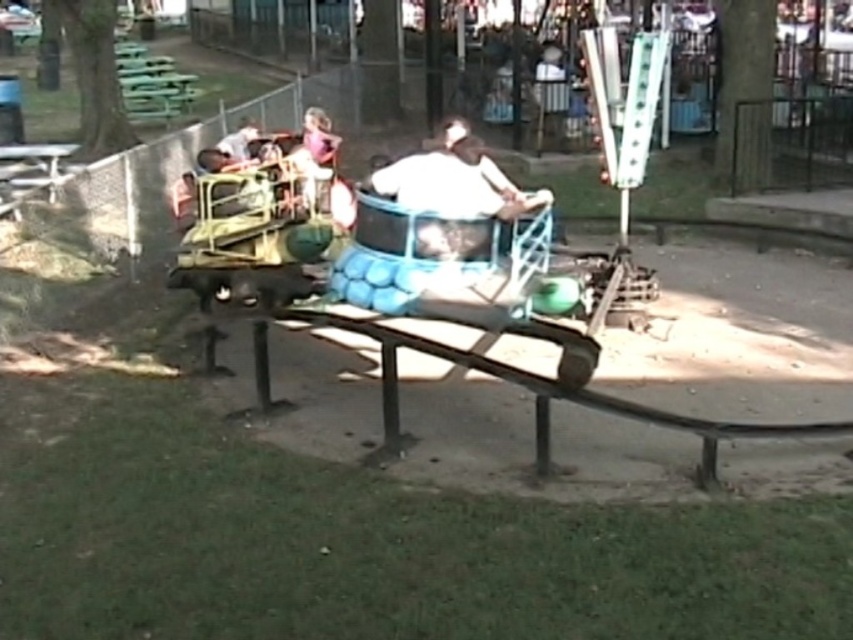
Who is more forward, (x=490, y=193) or (x=306, y=172)?

Point (x=490, y=193) is in front.

Does white matte shirt at center have a lesser height compared to matte purple shirt at center?

No, white matte shirt at center is not shorter than matte purple shirt at center.

The height and width of the screenshot is (640, 853). Describe the element at coordinates (456, 180) in the screenshot. I see `white matte shirt at center` at that location.

Identify the location of white matte shirt at center. (456, 180).